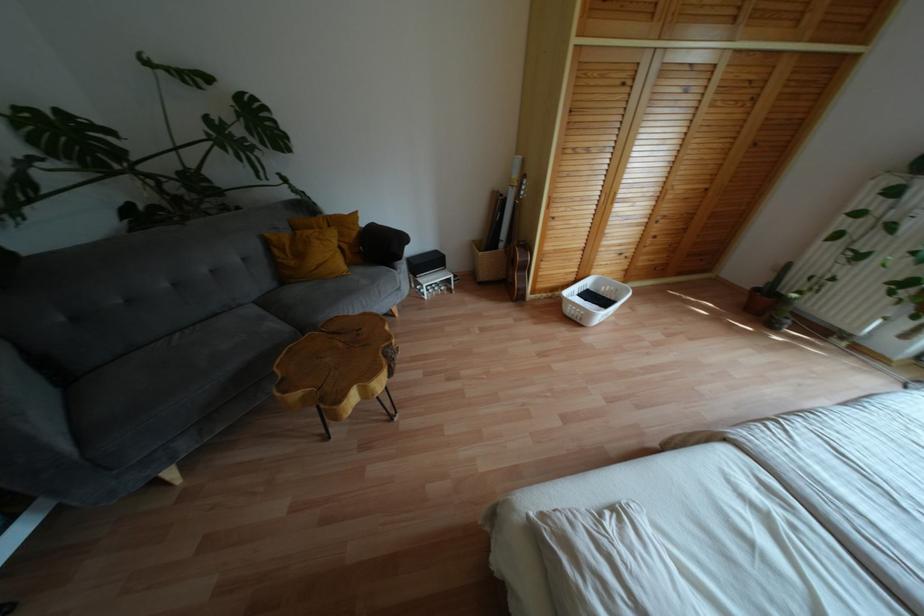
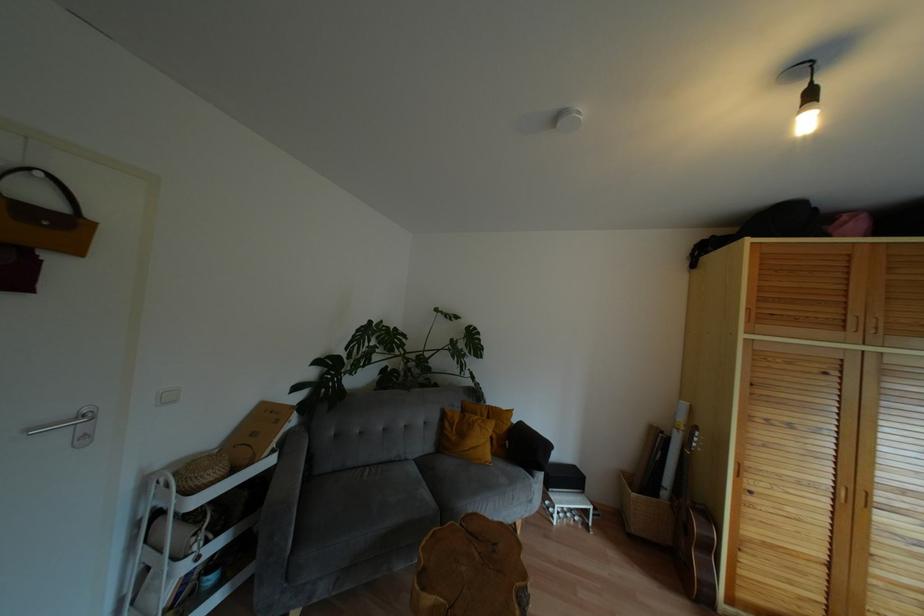
The images are taken continuously from a first-person perspective. In which direction is your viewpoint rotating?

The rotation direction of the camera is left-up.